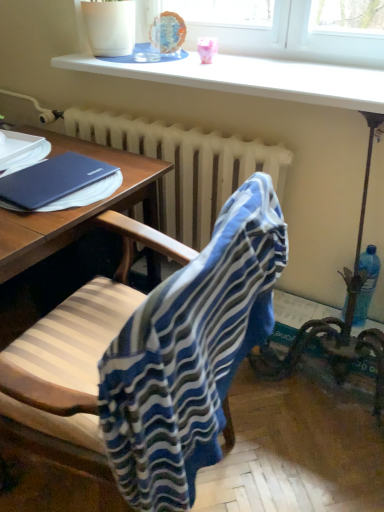
This screenshot has width=384, height=512. What do you see at coordinates (191, 353) in the screenshot?
I see `blue striped fabric at center` at bounding box center [191, 353].

What do you see at coordinates (59, 184) in the screenshot?
I see `matte blue notebook at left` at bounding box center [59, 184].

In order to face matte blue notebook at left, should I rotate leftwards or rightwards?

To align with it, rotate left about 18.153°.

This screenshot has height=512, width=384. I want to click on blue striped fabric at center, so click(191, 353).

Measure the distance between blue striped fabric at center and white radiator at center.

blue striped fabric at center and white radiator at center are 34.17 inches apart.

Does blue striped fabric at center come behind white radiator at center?

No.

Does point (121, 348) come in front of point (177, 173)?

Yes, point (121, 348) is in front of point (177, 173).

Can we say matte blue notebook at left lies outside blue plastic bottle at right?

Absolutely, matte blue notebook at left is external to blue plastic bottle at right.

How many degrees apart are the facing directions of matte blue notebook at left and blue plastic bottle at right?

The facing directions of matte blue notebook at left and blue plastic bottle at right are 4.81 degrees apart.

From a real-world perspective, which object stands above the other?

From a 3D spatial view, matte blue notebook at left is above.

From the picture: Is blue plastic bottle at right at the back of matte blue notebook at left?

No, matte blue notebook at left is not facing away from blue plastic bottle at right.

Can we say blue striped fabric at center lies outside blue plastic bottle at right?

That's correct, blue striped fabric at center is outside of blue plastic bottle at right.

Where is `chair on the left of the blue plastic bottle at right`? This screenshot has width=384, height=512. chair on the left of the blue plastic bottle at right is located at coordinates (191, 353).

Is blue striped fabric at center bigger than blue plastic bottle at right?

Yes, blue striped fabric at center is bigger than blue plastic bottle at right.

Considering the relative positions of blue striped fabric at center and blue plastic bottle at right in the image provided, is blue striped fabric at center to the left or to the right of blue plastic bottle at right?

From the image, it's evident that blue striped fabric at center is to the left of blue plastic bottle at right.

Is blue plastic bottle at right at the back of white radiator at center?

That's not correct — white radiator at center is not looking away from blue plastic bottle at right.

Considering the sizes of white radiator at center and blue plastic bottle at right in the image, is white radiator at center bigger or smaller than blue plastic bottle at right?

white radiator at center is bigger than blue plastic bottle at right.

Where is `radiator on the left of the blue plastic bottle at right`? This screenshot has width=384, height=512. radiator on the left of the blue plastic bottle at right is located at coordinates (185, 166).

Which is correct: white radiator at center is inside blue plastic bottle at right, or outside of it?

white radiator at center is spatially situated outside blue plastic bottle at right.

Find the location of a particular element. This screenshot has height=512, width=384. radiator in front of the blue plastic bottle at right is located at coordinates (185, 166).

Is blue plastic bottle at right bigger or smaller than white radiator at center?

Clearly, blue plastic bottle at right is smaller in size than white radiator at center.

Can you confirm if blue plastic bottle at right is wider than white radiator at center?

No, blue plastic bottle at right is not wider than white radiator at center.

Measure the distance from blue plastic bottle at right to white radiator at center.

They are 69.26 centimeters apart.

Can you tell me how much blue plastic bottle at right and blue striped fabric at center differ in facing direction?

The angle between the facing direction of blue plastic bottle at right and the facing direction of blue striped fabric at center is 90 degrees.

In the scene shown: From the image's perspective, is blue plastic bottle at right under blue striped fabric at center?

No.

Which is closer, (367,297) or (173,414)?

Clearly, point (367,297) is more distant from the camera than point (173,414).

Could blue striped fabric at center be considered to be inside blue plastic bottle at right?

No, blue plastic bottle at right does not contain blue striped fabric at center.

Considering the relative positions of blue plastic bottle at right and matte blue notebook at left in the image provided, is blue plastic bottle at right to the right of matte blue notebook at left from the viewer's perspective?

Yes, blue plastic bottle at right is to the right of matte blue notebook at left.

Between blue plastic bottle at right and matte blue notebook at left, which one has smaller size?

blue plastic bottle at right.

Does blue plastic bottle at right have a greater height compared to matte blue notebook at left?

Yes, blue plastic bottle at right is taller than matte blue notebook at left.

Is blue plastic bottle at right not close to matte blue notebook at left?

Absolutely, blue plastic bottle at right is distant from matte blue notebook at left.

This screenshot has width=384, height=512. Find the location of `radiator on the right of blue striped fabric at center`. radiator on the right of blue striped fabric at center is located at coordinates (185, 166).

You are a GUI agent. You are given a task and a screenshot of the screen. Output one action in this format:
    pyautogui.click(x=<x>, y=<y>)
    Task: Click on the bottle behind the matte blue notebook at left
    
    Given the screenshot: What is the action you would take?
    pyautogui.click(x=366, y=284)

Based on their spatial positions, is blue plastic bottle at right or white radiator at center closer to matte blue notebook at left?

Among the two, white radiator at center is located nearer to matte blue notebook at left.

Considering their positions, is matte blue notebook at left positioned further to blue striped fabric at center than blue plastic bottle at right?

blue plastic bottle at right is positioned further to the anchor blue striped fabric at center.

Which object lies further to the anchor point blue plastic bottle at right, blue striped fabric at center or matte blue notebook at left?

matte blue notebook at left lies further to blue plastic bottle at right than the other object.

When comparing their distances from blue plastic bottle at right, does blue striped fabric at center or white radiator at center seem closer?

Based on the image, white radiator at center appears to be nearer to blue plastic bottle at right.

Estimate the real-world distances between objects in this image. Which object is closer to white radiator at center, matte blue notebook at left or blue striped fabric at center?

matte blue notebook at left is positioned closer to the anchor white radiator at center.

From the image, which object appears to be farther from blue striped fabric at center, white radiator at center or blue plastic bottle at right?

Among the two, blue plastic bottle at right is located further to blue striped fabric at center.

From the picture: Which object lies further to the anchor point blue striped fabric at center, blue plastic bottle at right or matte blue notebook at left?

blue plastic bottle at right is further to blue striped fabric at center.

Estimate the real-world distances between objects in this image. Which object is closer to blue plastic bottle at right, matte blue notebook at left or blue striped fabric at center?

Based on the image, blue striped fabric at center appears to be nearer to blue plastic bottle at right.

Where is `radiator positioned between blue striped fabric at center and blue plastic bottle at right from near to far`? radiator positioned between blue striped fabric at center and blue plastic bottle at right from near to far is located at coordinates (185, 166).

At what (x,y) coordinates should I click in order to perform the action: click on radiator between matte blue notebook at left and blue plastic bottle at right in the horizontal direction. Please return your answer as a coordinate pair (x, y). The height and width of the screenshot is (512, 384). Looking at the image, I should click on (185, 166).

At what (x,y) coordinates should I click in order to perform the action: click on notebook between blue striped fabric at center and white radiator at center from front to back. Please return your answer as a coordinate pair (x, y). The width and height of the screenshot is (384, 512). Looking at the image, I should click on (59, 184).

Identify the location of chair between matte blue notebook at left and blue plastic bottle at right from left to right. (191, 353).